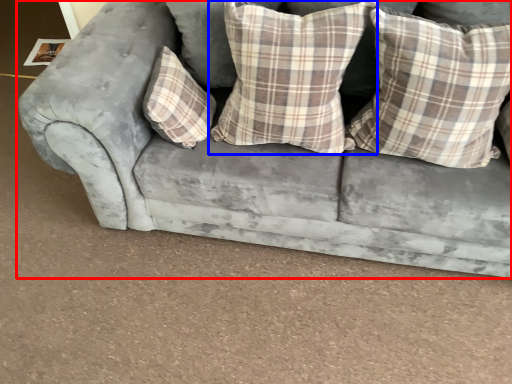
Question: Among these objects, which one is nearest to the camera, studio couch (highlighted by a red box) or pillow (highlighted by a blue box)?

Choices:
 (A) studio couch
 (B) pillow

Answer: (A)